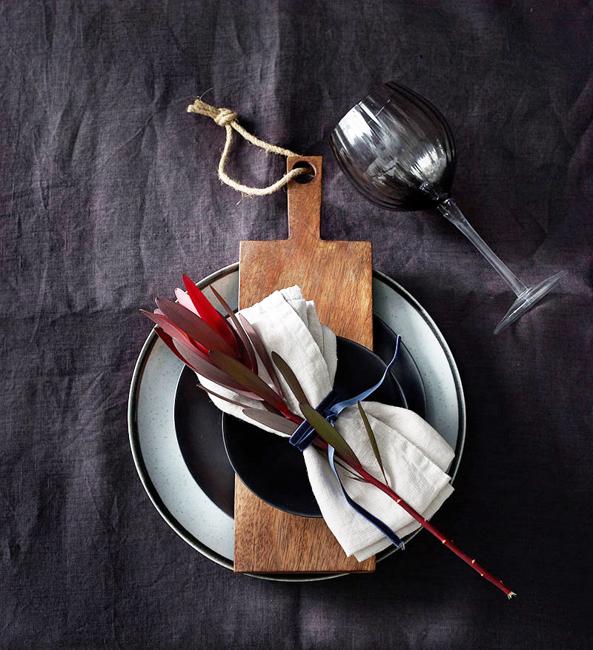
In order to click on plate in this screenshot , I will do `click(186, 455)`.